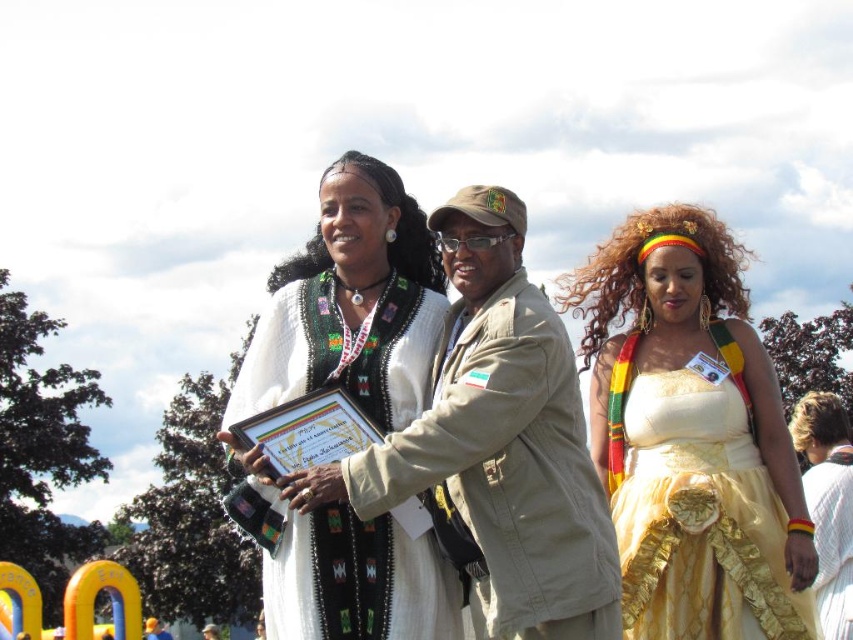
Question: Does khaki fabric jacket at center have a lesser width compared to white fabric at center?

Choices:
 (A) no
 (B) yes

Answer: (B)

Question: Which point is closer to the camera taking this photo?

Choices:
 (A) (793, 563)
 (B) (809, 614)
 (C) (582, 470)

Answer: (C)

Question: From the image, what is the correct spatial relationship of khaki fabric jacket at center in relation to yellow satin dress at center?

Choices:
 (A) left
 (B) right

Answer: (A)

Question: Which point is farther to the camera?

Choices:
 (A) (480, 216)
 (B) (817, 609)
 (C) (718, 342)

Answer: (B)

Question: In this image, where is gold satin dress at center located relative to white woven dress at center?

Choices:
 (A) right
 (B) left

Answer: (A)

Question: Which point is farther to the camera?

Choices:
 (A) khaki fabric jacket at center
 (B) yellow satin dress at center
 (C) gold satin dress at center

Answer: (B)